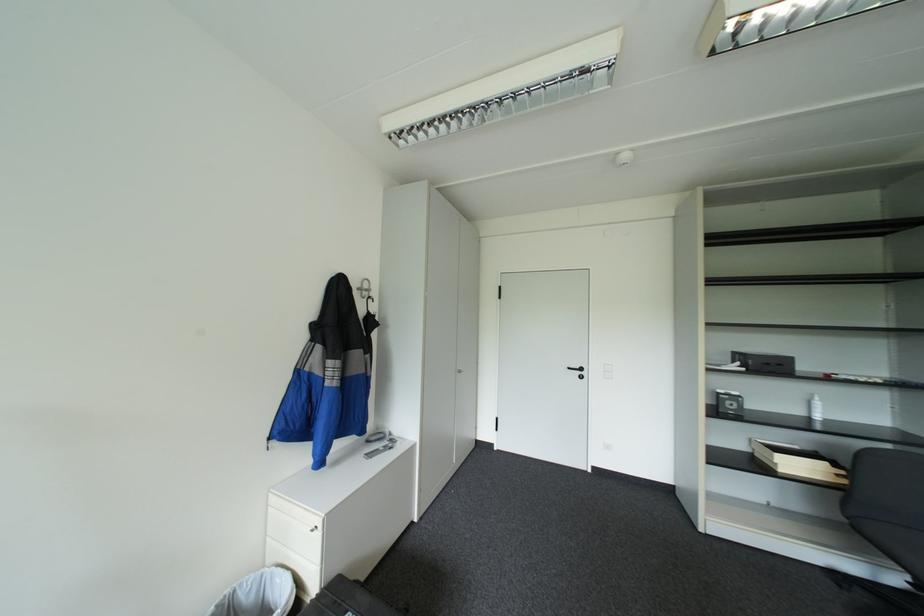
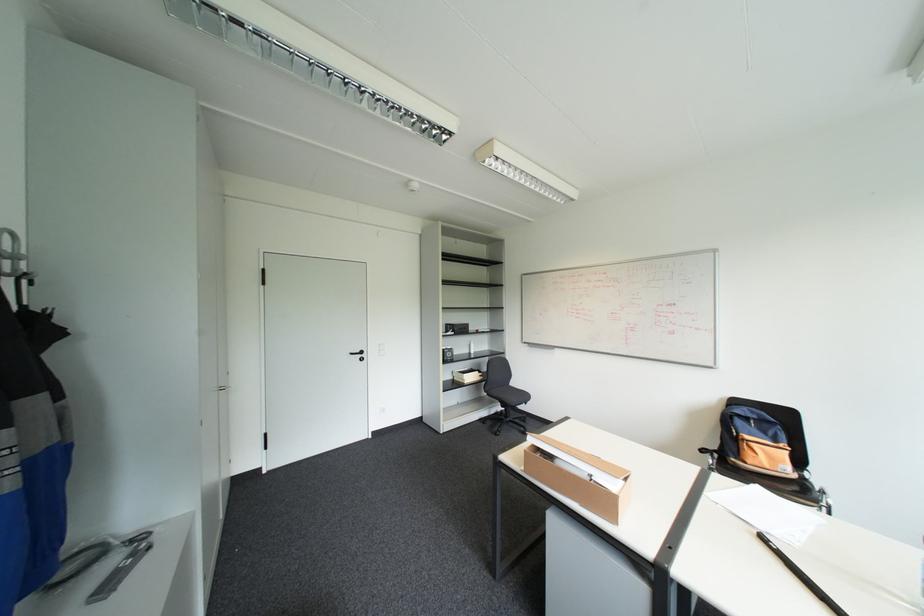
In the second image, find the point that corresponds to point 577,367 in the first image.

(359, 353)